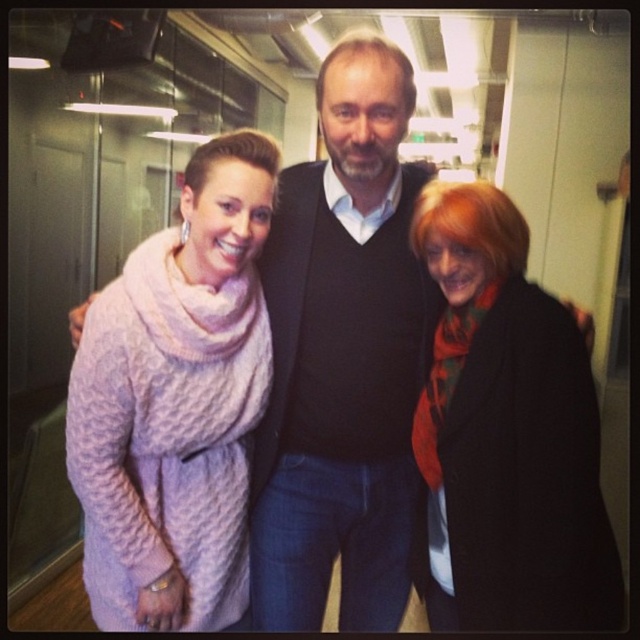
Consider the image. You are a photographer adjusting your camera settings in this office scene. You notice two points marked at coordinates point (x=198, y=593) and point (x=529, y=326). Which point is closer to the camera lens?

Point (x=198, y=593) is closer to the camera lens because it is further to the camera than point (x=529, y=326).